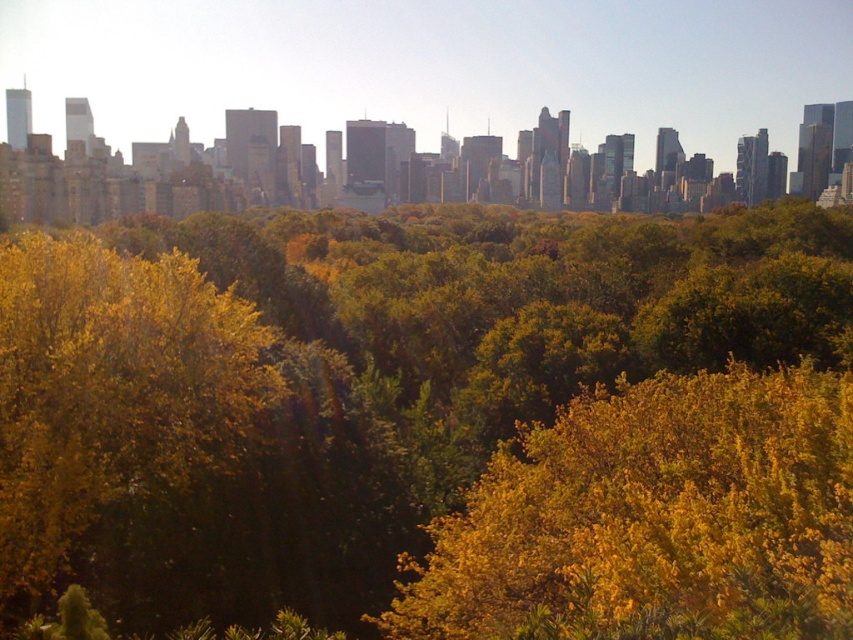
You are standing in the urban landscape scene and want to determine which of the two points, point (105, 305) or point (107, 339), is closer to you. Based on the scene description, which point is nearer?

Point (105, 305) is closer to the viewer than point (107, 339).